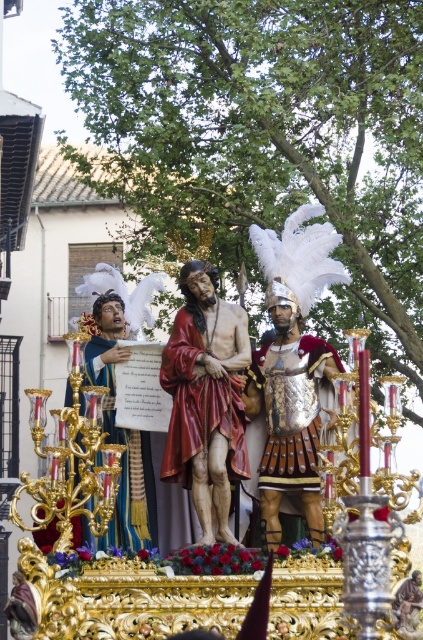
Find the location of a particular element. Image resolution: width=423 pixels, height=640 pixels. polished gold statue at center is located at coordinates (261, 362).

Is point (290, 609) positioned after point (99, 547)?

No, it is not.

This screenshot has width=423, height=640. What do you see at coordinates (261, 362) in the screenshot?
I see `polished gold statue at center` at bounding box center [261, 362].

This screenshot has height=640, width=423. I want to click on polished gold statue at center, so click(x=261, y=362).

Can you confirm if smooth red robe at center is positioned to the right of blue velvet robe at center?

Correct, you'll find smooth red robe at center to the right of blue velvet robe at center.

Can you confirm if smooth red robe at center is taller than blue velvet robe at center?

No, smooth red robe at center is not taller than blue velvet robe at center.

Is point (175, 422) closer to viewer compared to point (125, 467)?

Yes, it is in front of point (125, 467).

Identify the location of smooth red robe at center. Image resolution: width=423 pixels, height=640 pixels. (197, 406).

Does gold metallic armor at center appear on the right side of blue velvet robe at center?

Correct, you'll find gold metallic armor at center to the right of blue velvet robe at center.

Can you confirm if gold metallic armor at center is positioned above blue velvet robe at center?

Yes.

At what (x,y) coordinates should I click in order to perform the action: click on gold metallic armor at center. Please return your answer as a coordinate pair (x, y). Image resolution: width=423 pixels, height=640 pixels. Looking at the image, I should click on (288, 413).